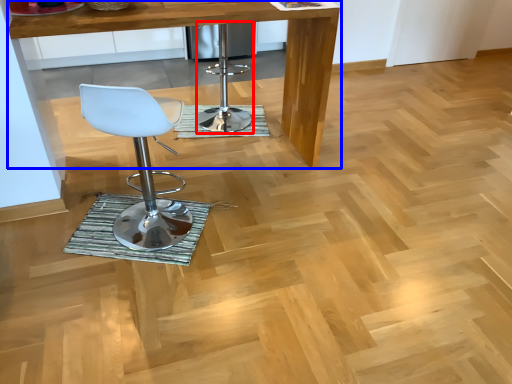
Question: Which of the following is the closest to the observer, bar stool (highlighted by a red box) or table (highlighted by a blue box)?

Choices:
 (A) bar stool
 (B) table

Answer: (B)